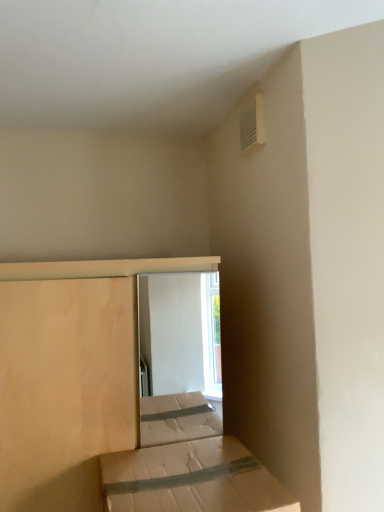
Question: Looking at the image, does natural wood bed at center, marked as the 1th bed in a back-to-front arrangement, seem bigger or smaller compared to white plastic vent at upper right?

Choices:
 (A) big
 (B) small

Answer: (A)

Question: Considering the positions of point (18, 346) and point (263, 136), is point (18, 346) closer or farther from the camera than point (263, 136)?

Choices:
 (A) closer
 (B) farther

Answer: (A)

Question: Estimate the real-world distances between objects in this image. Which object is closer to the natural wood bed at center, marked as the 1th bed in a back-to-front arrangement?

Choices:
 (A) white plastic vent at upper right
 (B) brown cardboard box at lower center, marked as the 1th bed in a front-to-back arrangement

Answer: (B)

Question: Estimate the real-world distances between objects in this image. Which object is farther from the white plastic vent at upper right?

Choices:
 (A) natural wood bed at center, positioned as the 2th bed in front-to-back order
 (B) brown cardboard box at lower center, marked as the second bed in a back-to-front arrangement

Answer: (B)